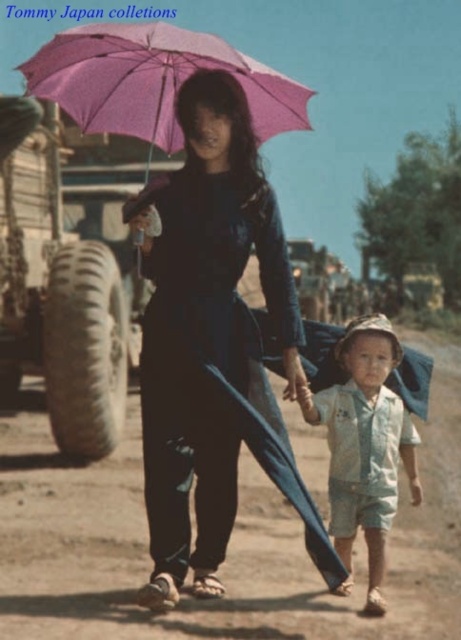
Question: Does matte black ao dai at center have a greater width compared to rubber tire at left?

Choices:
 (A) yes
 (B) no

Answer: (A)

Question: Estimate the real-world distances between objects in this image. Which object is closer to the matte black ao dai at center?

Choices:
 (A) rubber tire at left
 (B) pink fabric umbrella at upper center
 (C) light blue cotton shirt at lower right

Answer: (C)

Question: Which point appears closest to the camera in this image?

Choices:
 (A) (160, 371)
 (B) (81, 385)
 (C) (377, 483)
 (D) (74, 29)

Answer: (D)

Question: Can you confirm if matte black ao dai at center is wider than light blue cotton shirt at lower right?

Choices:
 (A) yes
 (B) no

Answer: (A)

Question: Estimate the real-world distances between objects in this image. Which object is closer to the light blue cotton shirt at lower right?

Choices:
 (A) rubber tire at left
 (B) pink fabric umbrella at upper center

Answer: (B)

Question: Is matte black ao dai at center to the left of light blue cotton shirt at lower right from the viewer's perspective?

Choices:
 (A) yes
 (B) no

Answer: (A)